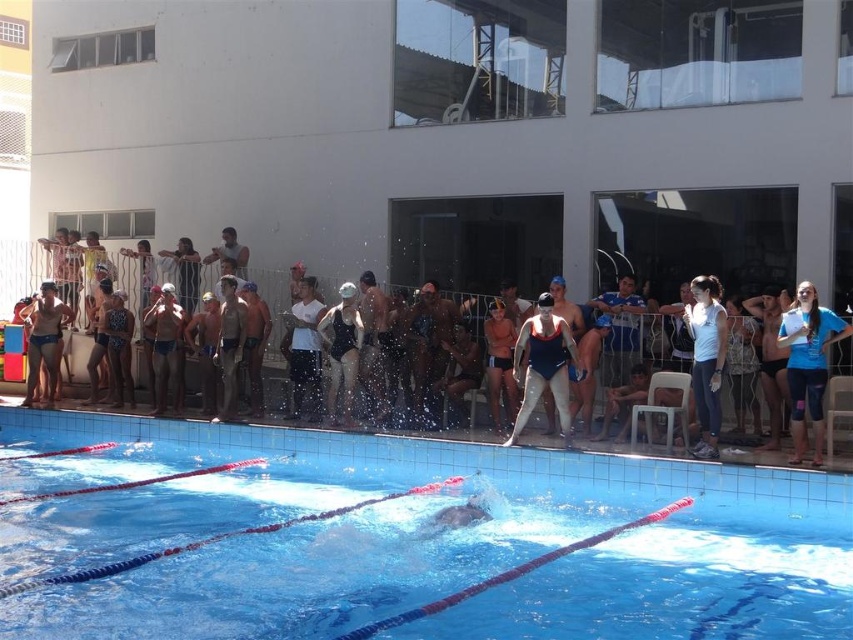
Question: Which point is closer to the camera?

Choices:
 (A) (711, 424)
 (B) (419, 317)
 (C) (788, 333)

Answer: (C)

Question: Is the position of white matte swimsuit at center less distant than that of black matte swimsuit at center?

Choices:
 (A) yes
 (B) no

Answer: (A)

Question: Is the position of solid blue swimsuit at center more distant than that of black matte swimsuit at center?

Choices:
 (A) yes
 (B) no

Answer: (B)

Question: Is blue glossy swimsuit at center below black matte swimsuit at center?

Choices:
 (A) yes
 (B) no

Answer: (A)

Question: Among these points, which one is farthest from the camera?

Choices:
 (A) (703, 435)
 (B) (518, 362)
 (C) (654, 401)
 (D) (811, 298)

Answer: (B)

Question: Which point appears farthest from the camera in this image?

Choices:
 (A) (212, 481)
 (B) (524, 336)
 (C) (511, 330)

Answer: (C)